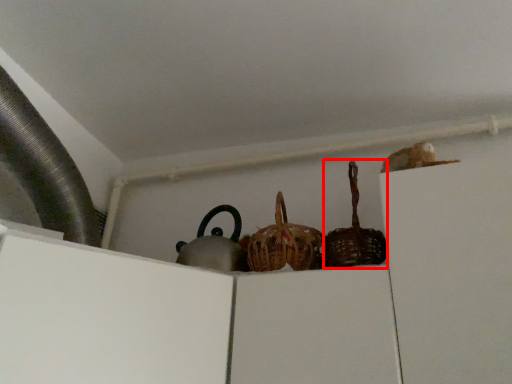
Question: Where is basket (annotated by the red box) located in relation to basket in the image?

Choices:
 (A) left
 (B) right

Answer: (B)